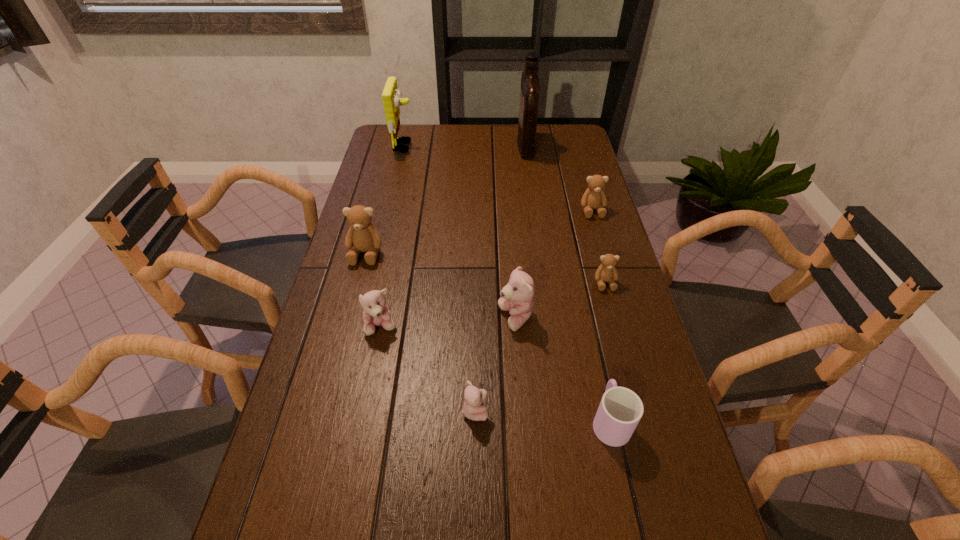
What are the coordinates of `cup` in the screenshot? It's located at (620, 410).

The height and width of the screenshot is (540, 960). I want to click on the smallest brown teddy bear, so (x=606, y=272).

Image resolution: width=960 pixels, height=540 pixels. In order to click on the fourth nearest teddy bear in this screenshot , I will do `click(606, 272)`.

At what (x,y) coordinates should I click in order to perform the action: click on the nearest pink teddy bear. Please return your answer as a coordinate pair (x, y). Looking at the image, I should click on (472, 409).

What are the coordinates of `the second pink teddy bear from right to left` in the screenshot? It's located at [472, 409].

I want to click on vacant space located on the label side of the liquor, so click(x=417, y=146).

The height and width of the screenshot is (540, 960). Identify the location of vacant area situated 0.320m on the label side of the liquor. (435, 146).

At what (x,y) coordinates should I click in order to perform the action: click on vacant space situated 0.330m on the label side of the liquor. Please return your answer as a coordinate pair (x, y). This screenshot has width=960, height=540. Looking at the image, I should click on (432, 146).

Image resolution: width=960 pixels, height=540 pixels. Identify the location of free space located on the face of the second tallest object. (454, 146).

What are the coordinates of `vacant space located at the face of the fourth teddy bear from left to right` in the screenshot? It's located at (379, 318).